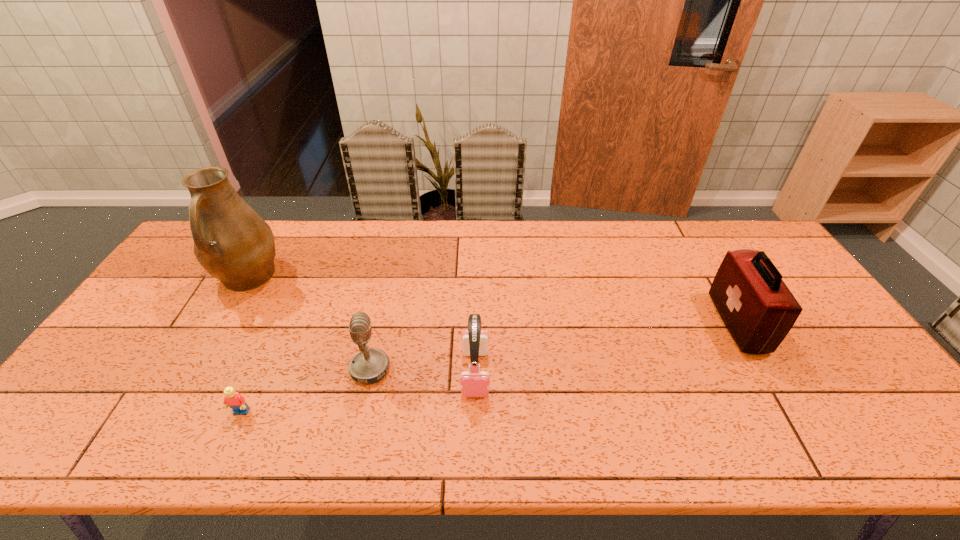
In the image, there is a desktop. Where is `vacant space at the right edge`? This screenshot has height=540, width=960. vacant space at the right edge is located at coordinates (833, 330).

Find the location of a particular element. The image size is (960, 540). blank space at the near left corner is located at coordinates (89, 423).

Image resolution: width=960 pixels, height=540 pixels. In order to click on vacant space that's between the nearest object and the third object from left to right in this screenshot , I will do `click(305, 391)`.

Locate an element on the screen. free space between the Lego and the microphone is located at coordinates (305, 391).

This screenshot has width=960, height=540. I want to click on vacant area between the rightmost object and the nearest object, so click(x=490, y=368).

Find the location of a particular element. The width and height of the screenshot is (960, 540). free space between the pitcher and the third object from left to right is located at coordinates (309, 323).

Find the location of a particular element. The height and width of the screenshot is (540, 960). vacant area that lies between the rightmost object and the nearest object is located at coordinates (490, 368).

At what (x,y) coordinates should I click in order to perform the action: click on blank region between the earphone and the first aid kit. Please return your answer as a coordinate pair (x, y). Looking at the image, I should click on (607, 348).

Find the location of `vacant area between the shortest object and the rightmost object`. vacant area between the shortest object and the rightmost object is located at coordinates (490, 368).

The width and height of the screenshot is (960, 540). I want to click on blank region between the earphone and the rightmost object, so click(x=607, y=348).